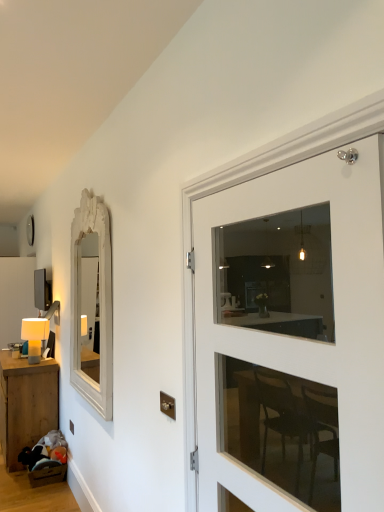
Question: From the image's perspective, is white carved wood mirror at left beneath matte white table lamp at left?

Choices:
 (A) no
 (B) yes

Answer: (A)

Question: From a real-world perspective, is white carved wood mirror at left physically below matte white table lamp at left?

Choices:
 (A) yes
 (B) no

Answer: (B)

Question: From the image's perspective, does white carved wood mirror at left appear higher than matte white table lamp at left?

Choices:
 (A) no
 (B) yes

Answer: (B)

Question: Does white carved wood mirror at left have a larger size compared to matte white table lamp at left?

Choices:
 (A) no
 (B) yes

Answer: (B)

Question: Can you confirm if white carved wood mirror at left is shorter than matte white table lamp at left?

Choices:
 (A) no
 (B) yes

Answer: (A)

Question: In terms of size, does white carved wood mirror at left appear bigger or smaller than matte white table lamp at left?

Choices:
 (A) small
 (B) big

Answer: (B)

Question: From a real-world perspective, is white carved wood mirror at left physically located above or below matte white table lamp at left?

Choices:
 (A) below
 (B) above

Answer: (B)

Question: Visually, is white carved wood mirror at left positioned to the left or to the right of matte white table lamp at left?

Choices:
 (A) right
 (B) left

Answer: (A)

Question: Is white carved wood mirror at left inside the boundaries of matte white table lamp at left, or outside?

Choices:
 (A) inside
 (B) outside

Answer: (B)

Question: Looking at the image, does wooden table at lower left seem bigger or smaller compared to matte white table lamp at left?

Choices:
 (A) small
 (B) big

Answer: (B)

Question: From a real-world perspective, is wooden table at lower left above or below matte white table lamp at left?

Choices:
 (A) above
 (B) below

Answer: (B)

Question: Would you say wooden table at lower left is inside or outside matte white table lamp at left?

Choices:
 (A) inside
 (B) outside

Answer: (B)

Question: From the image's perspective, is wooden table at lower left located above or below matte white table lamp at left?

Choices:
 (A) above
 (B) below

Answer: (B)

Question: Considering the positions of matte white table lamp at left and white carved wood mirror at left in the image, is matte white table lamp at left wider or thinner than white carved wood mirror at left?

Choices:
 (A) thin
 (B) wide

Answer: (B)

Question: From the image's perspective, relative to white carved wood mirror at left, is matte white table lamp at left above or below?

Choices:
 (A) below
 (B) above

Answer: (A)